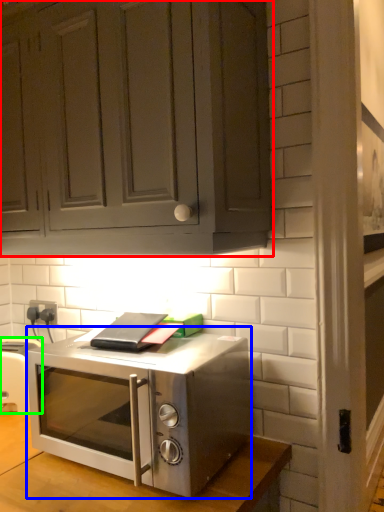
Question: Which is farther away from cabinetry (highlighted by a red box)? microwave oven (highlighted by a blue box) or appliance (highlighted by a green box)?

Choices:
 (A) microwave oven
 (B) appliance

Answer: (B)